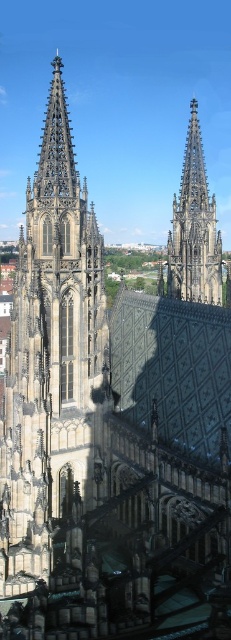
You are standing in front of the cathedral and want to take a photo of the dark gray stone tower at left and the dark gray stone spire at center. Which one will appear larger in your photo?

The dark gray stone tower at left will appear larger in your photo because it is closer to the viewer than the dark gray stone spire at center.

You are an architect examining the cathedral. You need to determine which of the two dark gray stone structures, the dark gray stone tower at left or the dark gray stone spire at center, has a greater horizontal span. Based on the description, which one is wider?

The dark gray stone tower at left has a greater horizontal span than the dark gray stone spire at center because its width is larger.

You are standing in front of the cathedral and want to take a photo that includes both the dark gray stone tower at left and the dark gray stone spire at center. Which one should you position closer to the left side of your camera frame?

You should position the dark gray stone tower at left closer to the left side of your camera frame because it is already located to the left of the dark gray stone spire at center.